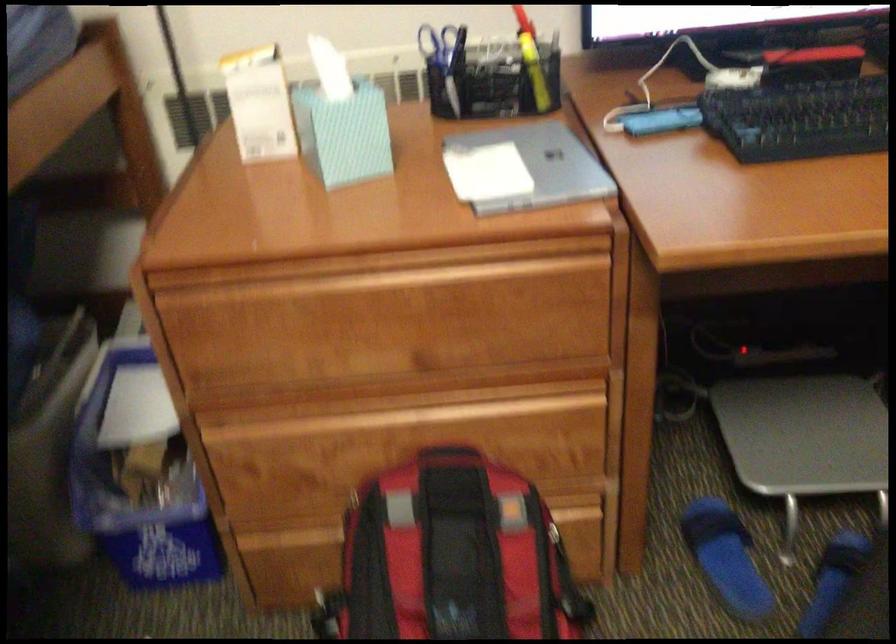
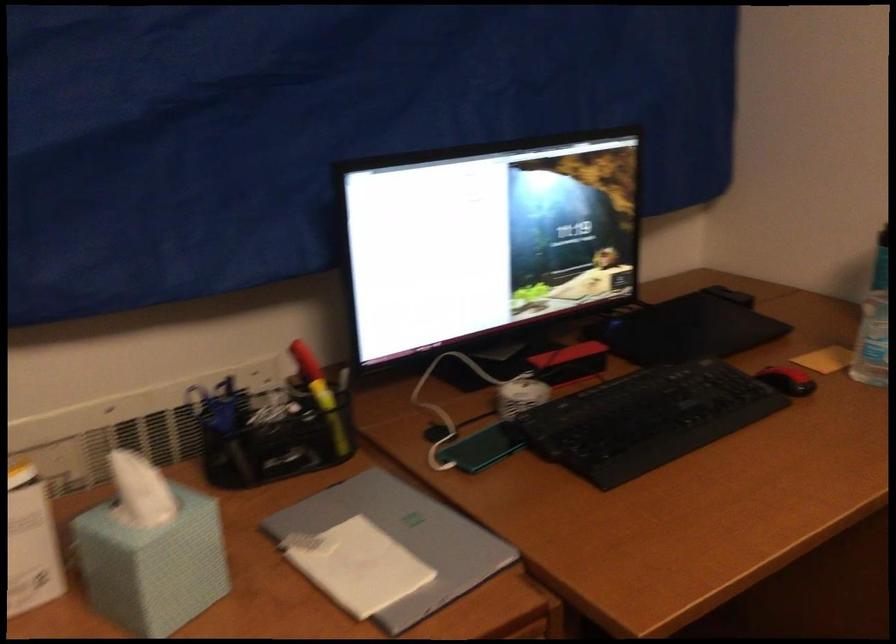
In the second image, find the point that corresponds to [483,172] in the first image.

(357, 565)